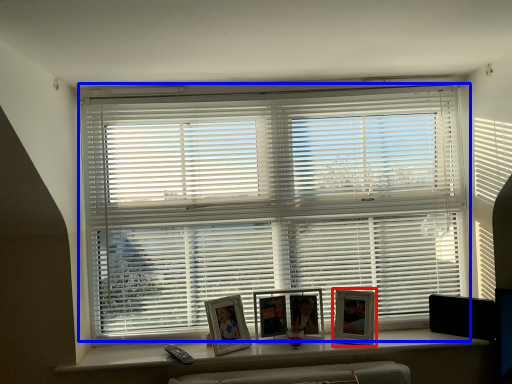
Question: Which object is closer to the camera taking this photo, picture frame (highlighted by a red box) or window blind (highlighted by a blue box)?

Choices:
 (A) picture frame
 (B) window blind

Answer: (A)